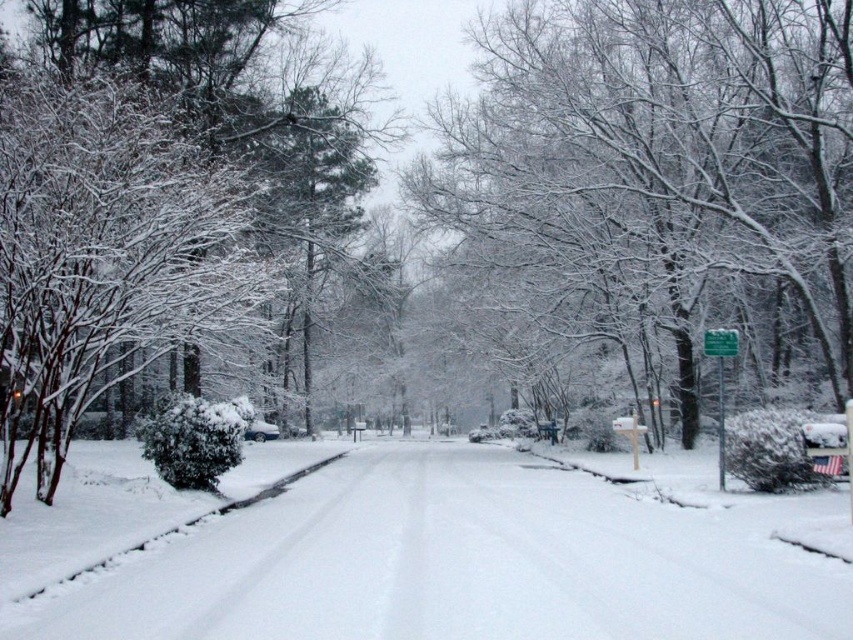
Question: Which point is closer to the camera?

Choices:
 (A) (606, 561)
 (B) (711, 344)
 (C) (780, 22)

Answer: (A)

Question: Which of the following is the farthest from the observer?

Choices:
 (A) (483, 17)
 (B) (189, 579)

Answer: (A)

Question: Which point is closer to the camera taking this photo?

Choices:
 (A) (728, 173)
 (B) (39, 214)

Answer: (B)

Question: Is snow-covered branches at center smaller than green plastic sign at center right?

Choices:
 (A) yes
 (B) no

Answer: (B)

Question: Can you confirm if white fluffy snow at center is smaller than snow-covered branches at center?

Choices:
 (A) yes
 (B) no

Answer: (A)

Question: Is snow-covered branches at center thinner than green plastic sign at right?

Choices:
 (A) no
 (B) yes

Answer: (A)